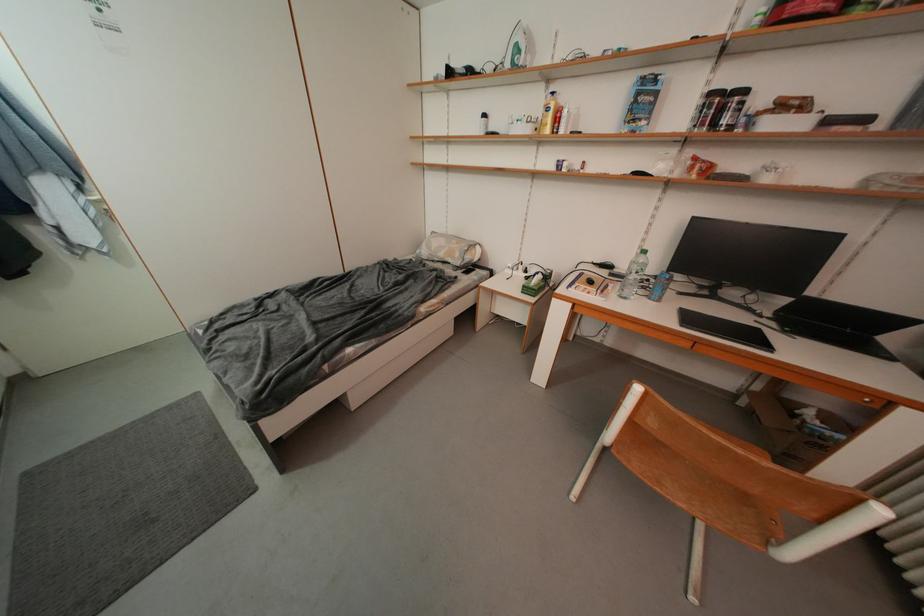
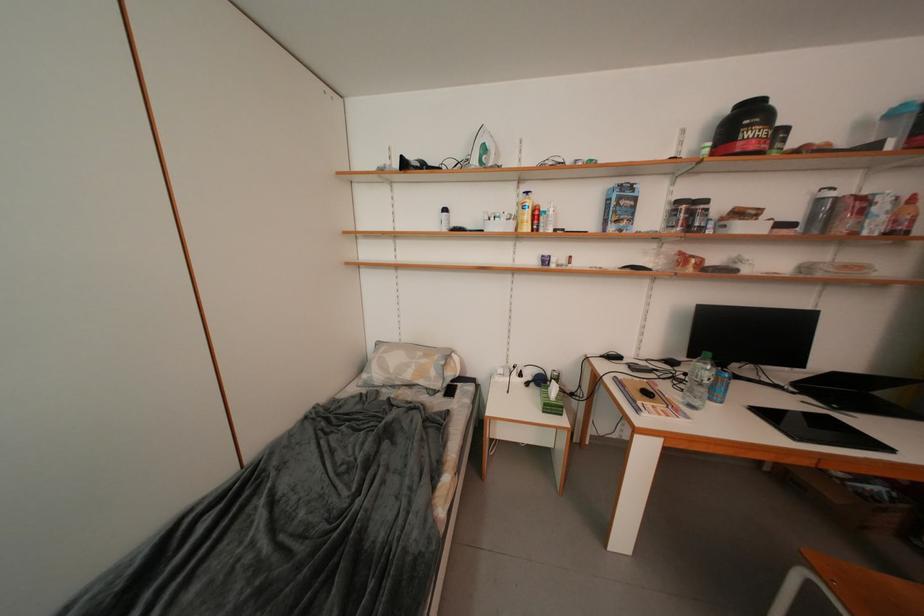
In a continuous first-person perspective shot, in which direction is the camera moving?

The cameraman moved toward left, forward.